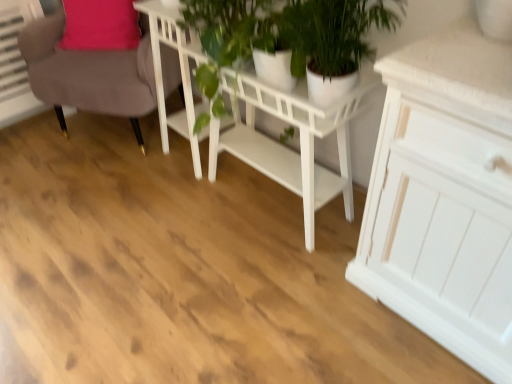
Looking at this image, measure the distance between white glossy pot at center and camera.

They are 1.28 meters apart.

What do you see at coordinates (181, 75) in the screenshot?
I see `white wooden table at center, placed as the 1th table when sorted from left to right` at bounding box center [181, 75].

Describe the element at coordinates (228, 38) in the screenshot. I see `green leafy plant at center` at that location.

Where is `white glossy table at center, which is counted as the first table, starting from the right`? white glossy table at center, which is counted as the first table, starting from the right is located at coordinates (254, 123).

From the image's perspective, which one is positioned lower, white glossy pot at center or white glossy table at center, the 2th table viewed from the left?

white glossy table at center, the 2th table viewed from the left, appears lower in the image.

In the image, is white glossy pot at center positioned in front of or behind white glossy table at center, the 2th table viewed from the left?

white glossy pot at center is positioned closer to the viewer than white glossy table at center, the 2th table viewed from the left.

Is white glossy pot at center placed right next to white glossy table at center, the 2th table viewed from the left?

There is a gap between white glossy pot at center and white glossy table at center, the 2th table viewed from the left.

Is white glossy pot at center looking in the opposite direction of white glossy table at center, which is counted as the first table, starting from the right?

No, white glossy pot at center's orientation is not away from white glossy table at center, which is counted as the first table, starting from the right.

From a real-world perspective, which is physically below, white glossy table at center, the 2th table viewed from the left, or suede-like brown chair at upper left?

From a 3D spatial view, white glossy table at center, the 2th table viewed from the left, is below.

How many degrees apart are the facing directions of white glossy table at center, the 2th table viewed from the left, and suede-like brown chair at upper left?

The angle between the facing direction of white glossy table at center, the 2th table viewed from the left, and the facing direction of suede-like brown chair at upper left is 24.8 degrees.

Which is correct: white glossy table at center, which is counted as the first table, starting from the right, is inside suede-like brown chair at upper left, or outside of it?

The correct answer is: outside.

Which object is positioned more to the right, white wooden table at center, placed as the 1th table when sorted from left to right, or green leafy plant at center?

From the viewer's perspective, green leafy plant at center appears more on the right side.

From a real-world perspective, is white wooden table at center, placed as the second table when sorted from right to left, positioned above or below green leafy plant at center?

From a real-world perspective, white wooden table at center, placed as the second table when sorted from right to left, is physically below green leafy plant at center.

Between white wooden table at center, placed as the second table when sorted from right to left, and green leafy plant at center, which one has more height?

With more height is white wooden table at center, placed as the second table when sorted from right to left.

Could you measure the distance between suede-like brown chair at upper left and white wooden table at center, placed as the 1th table when sorted from left to right?

suede-like brown chair at upper left is 30.56 centimeters away from white wooden table at center, placed as the 1th table when sorted from left to right.

This screenshot has width=512, height=384. In order to click on chair on the left of white wooden table at center, placed as the second table when sorted from right to left in this screenshot , I will do `click(89, 72)`.

Which object is closer to the camera taking this photo, suede-like brown chair at upper left or white wooden table at center, placed as the 1th table when sorted from left to right?

white wooden table at center, placed as the 1th table when sorted from left to right.

Considering the positions of point (89, 67) and point (174, 31), is point (89, 67) closer or farther from the camera than point (174, 31)?

Point (89, 67) appears to be farther away from the viewer than point (174, 31).

From a real-world perspective, does green leafy plant at center sit lower than white glossy table at center, which is counted as the first table, starting from the right?

Incorrect, from a real-world perspective, green leafy plant at center is higher than white glossy table at center, which is counted as the first table, starting from the right.

From the image's perspective, does green leafy plant at center appear lower than white glossy table at center, which is counted as the first table, starting from the right?

Incorrect, from the image's perspective, green leafy plant at center is higher than white glossy table at center, which is counted as the first table, starting from the right.

Image resolution: width=512 pixels, height=384 pixels. I want to click on plant above the white glossy table at center, which is counted as the first table, starting from the right (from the image's perspective), so click(x=228, y=38).

From their relative heights in the image, would you say green leafy plant at center is taller or shorter than white glossy table at center, the 2th table viewed from the left?

green leafy plant at center is shorter than white glossy table at center, the 2th table viewed from the left.

Is white wooden table at center, placed as the 1th table when sorted from left to right, smaller than white glossy pot at center?

Correct, white wooden table at center, placed as the 1th table when sorted from left to right, occupies less space than white glossy pot at center.

You are a GUI agent. You are given a task and a screenshot of the screen. Output one action in this format:
    pyautogui.click(x=<x>, y=<y>)
    Task: Click on the table that is the 2nd object located behind the white glossy pot at center
    The width and height of the screenshot is (512, 384).
    Given the screenshot: What is the action you would take?
    pyautogui.click(x=181, y=75)

Considering the relative positions of white wooden table at center, placed as the 1th table when sorted from left to right, and white glossy pot at center in the image provided, is white wooden table at center, placed as the 1th table when sorted from left to right, to the right of white glossy pot at center from the viewer's perspective?

In fact, white wooden table at center, placed as the 1th table when sorted from left to right, is to the left of white glossy pot at center.

Considering the points (214, 156) and (189, 116), which point is behind, point (214, 156) or point (189, 116)?

The point (214, 156) is more distant.

Is white wooden table at center, placed as the 1th table when sorted from left to right, not close to white glossy table at center, the 2th table viewed from the left?

No, white wooden table at center, placed as the 1th table when sorted from left to right, is in close proximity to white glossy table at center, the 2th table viewed from the left.

Is white wooden table at center, placed as the second table when sorted from right to left, located outside white glossy table at center, the 2th table viewed from the left?

Yes, white wooden table at center, placed as the second table when sorted from right to left, is not within white glossy table at center, the 2th table viewed from the left.

Locate an element on the screen. table below the white wooden table at center, placed as the 1th table when sorted from left to right (from the image's perspective) is located at coordinates (254, 123).

Starting from the white glossy pot at center, which table is the 1st one to the left? Please provide its 2D coordinates.

[(254, 123)]

This screenshot has height=384, width=512. What are the coordinates of `chair lying above the white glossy table at center, the 2th table viewed from the left (from the image's perspective)` in the screenshot? It's located at (89, 72).

When comparing their distances from white glossy pot at center, does suede-like brown chair at upper left or white wooden table at center, placed as the second table when sorted from right to left, seem further?

suede-like brown chair at upper left is further to white glossy pot at center.

Based on their spatial positions, is white glossy pot at center or green leafy plant at center further from white glossy table at center, which is counted as the first table, starting from the right?

white glossy pot at center.

Which object lies further to the anchor point green leafy plant at center, white glossy table at center, the 2th table viewed from the left, or suede-like brown chair at upper left?

suede-like brown chair at upper left lies further to green leafy plant at center than the other object.

Based on their spatial positions, is white glossy pot at center or white glossy table at center, the 2th table viewed from the left, closer to white wooden table at center, placed as the 1th table when sorted from left to right?

white glossy table at center, the 2th table viewed from the left, lies closer to white wooden table at center, placed as the 1th table when sorted from left to right, than the other object.

Based on their spatial positions, is white wooden table at center, placed as the second table when sorted from right to left, or white glossy pot at center closer to green leafy plant at center?

The object closer to green leafy plant at center is white glossy pot at center.

From the image, which object appears to be farther from white wooden table at center, placed as the second table when sorted from right to left, suede-like brown chair at upper left or white glossy table at center, which is counted as the first table, starting from the right?

suede-like brown chair at upper left lies further to white wooden table at center, placed as the second table when sorted from right to left, than the other object.

When comparing their distances from white wooden table at center, placed as the second table when sorted from right to left, does green leafy plant at center or white glossy table at center, the 2th table viewed from the left, seem further?

The object further to white wooden table at center, placed as the second table when sorted from right to left, is green leafy plant at center.

When comparing their distances from green leafy plant at center, does white wooden table at center, placed as the second table when sorted from right to left, or suede-like brown chair at upper left seem further?

suede-like brown chair at upper left is further to green leafy plant at center.

Image resolution: width=512 pixels, height=384 pixels. I want to click on table situated between suede-like brown chair at upper left and green leafy plant at center from left to right, so click(181, 75).

At what (x,y) coordinates should I click in order to perform the action: click on table located between white glossy pot at center and green leafy plant at center in the depth direction. Please return your answer as a coordinate pair (x, y). This screenshot has height=384, width=512. Looking at the image, I should click on (x=254, y=123).

Where is `plant between suede-like brown chair at upper left and white glossy table at center, the 2th table viewed from the left`? Image resolution: width=512 pixels, height=384 pixels. plant between suede-like brown chair at upper left and white glossy table at center, the 2th table viewed from the left is located at coordinates (228, 38).

Locate an element on the screen. table between green leafy plant at center and white glossy table at center, which is counted as the first table, starting from the right, from top to bottom is located at coordinates (181, 75).